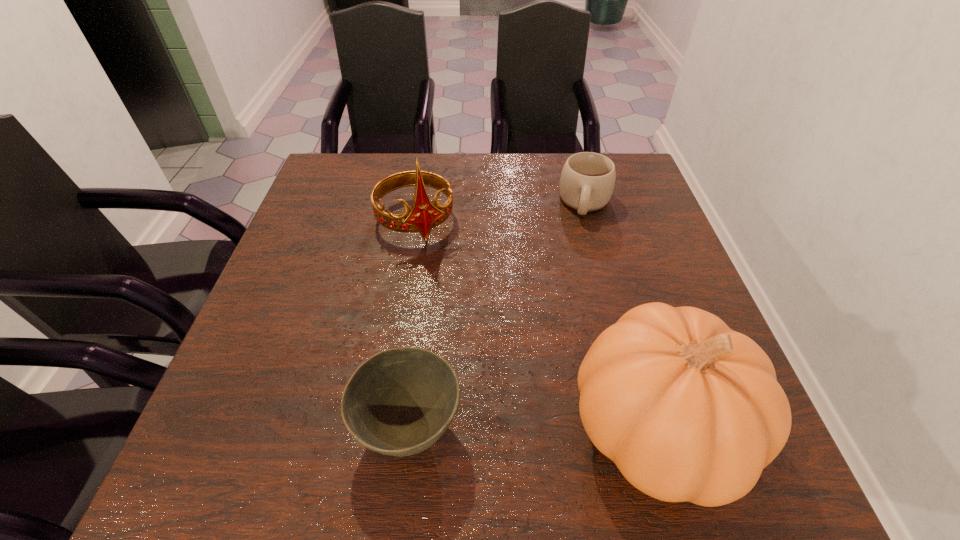
You are a GUI agent. You are given a task and a screenshot of the screen. Output one action in this format:
    pyautogui.click(x=<x>, y=<y>)
    Task: Click on the bowl
    The width and height of the screenshot is (960, 540).
    Given the screenshot: What is the action you would take?
    pyautogui.click(x=399, y=402)

The image size is (960, 540). In order to click on pumpkin in this screenshot , I will do `click(689, 410)`.

This screenshot has height=540, width=960. In order to click on mug in this screenshot , I will do `click(587, 180)`.

Find the location of a particular element. The image size is (960, 540). tiara is located at coordinates click(x=424, y=215).

Locate an element on the screen. Image resolution: width=960 pixels, height=540 pixels. blank space located on the back of the bowl is located at coordinates (418, 354).

Locate an element on the screen. free space located on the back of the pumpkin is located at coordinates (624, 315).

Where is `blank space located on the side of the mug with the handle`? blank space located on the side of the mug with the handle is located at coordinates (582, 238).

Locate an element on the screen. free space located on the side of the mug with the handle is located at coordinates (573, 304).

Locate an element on the screen. vacant space located on the side of the mug with the handle is located at coordinates (569, 333).

Locate an element on the screen. Image resolution: width=960 pixels, height=540 pixels. free space located on the front-facing side of the tiara is located at coordinates (439, 273).